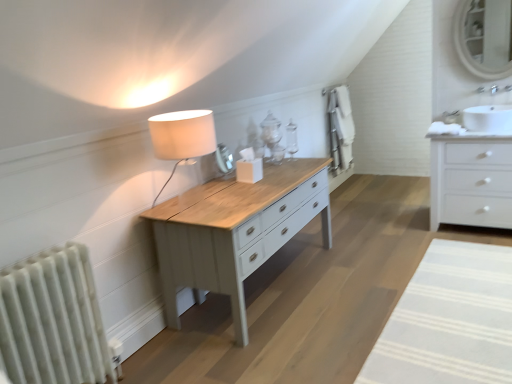
The width and height of the screenshot is (512, 384). In order to click on free space in front of white glossy chest of drawers at right in this screenshot , I will do `click(474, 246)`.